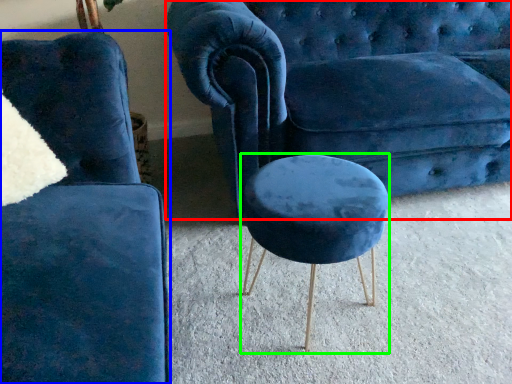
Question: Which object is positioned farthest from studio couch (highlighted by a red box)? Select from chair (highlighted by a blue box) and stool (highlighted by a green box).

Choices:
 (A) chair
 (B) stool

Answer: (A)